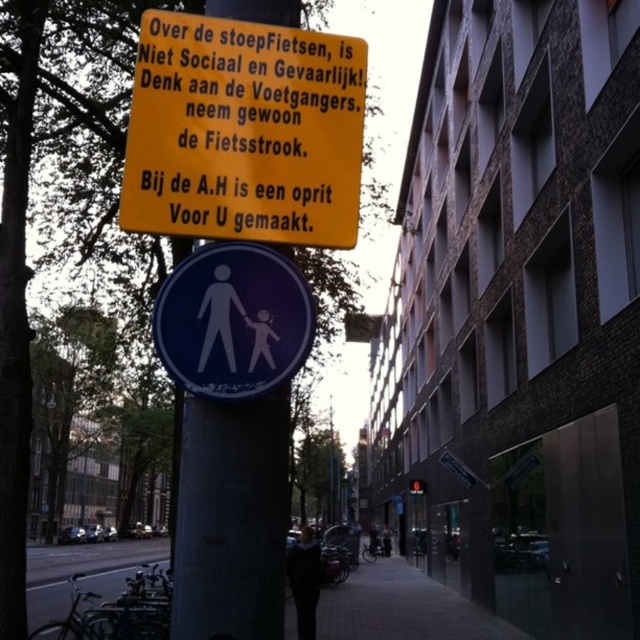
What is the exact coordinate of the paved sidewalk at center?

The paved sidewalk at center is located at point (x=403, y=609).

What are the coordinates of the smooth gray pole at center?

The smooth gray pole at center is located at coordinates point (x=230, y=518).

You are a cyclist approaching an intersection and see the yellow plastic sign at upper center and the matte black pedestrian at center. According to the sign, what should you do to avoid endangering the pedestrian?

The yellow plastic sign at upper center states that cycling over the sidewalk is not social and dangerous, so you should use the bike lane instead of endangering the matte black pedestrian at center.